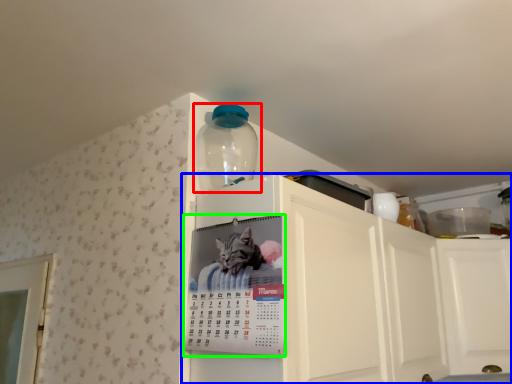
Question: Based on their relative distances, which object is nearer to bottle (highlighted by a red box)? Choose from cabinetry (highlighted by a blue box) and poster (highlighted by a green box).

Choices:
 (A) cabinetry
 (B) poster

Answer: (B)